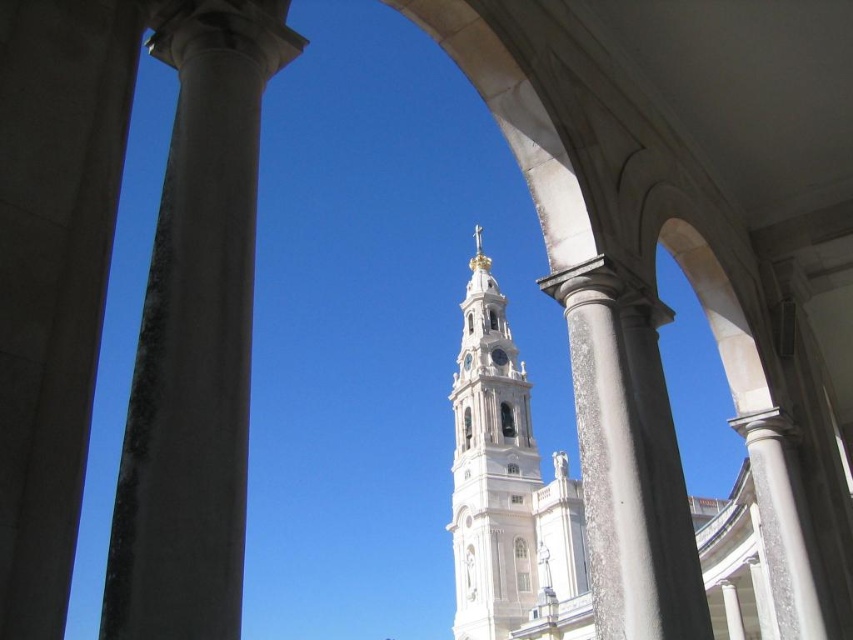
Does white stone column at left appear on the right side of white stone tower at center?

No, white stone column at left is not to the right of white stone tower at center.

Which is more to the right, white stone column at left or white stone tower at center?

Positioned to the right is white stone tower at center.

Is point (12, 189) more distant than point (469, 348)?

No, (12, 189) is in front of (469, 348).

Where is `white stone column at left`? This screenshot has width=853, height=640. white stone column at left is located at coordinates pos(53,276).

Is white marble column at left bigger than white stone tower at center?

No.

Is point (242, 93) positioned before point (514, 608)?

Yes, point (242, 93) is closer to viewer.

The height and width of the screenshot is (640, 853). What do you see at coordinates (195, 337) in the screenshot? I see `white marble column at left` at bounding box center [195, 337].

Locate an element on the screen. white marble column at left is located at coordinates (195, 337).

Between white stone column at left and white marble column at center, which one has more height?

white stone column at left is taller.

Does white stone column at left have a lesser width compared to white marble column at center?

Yes.

Measure the distance between white stone column at left and camera.

white stone column at left is 46.54 feet from camera.

The width and height of the screenshot is (853, 640). Find the location of `white stone column at left`. white stone column at left is located at coordinates (53, 276).